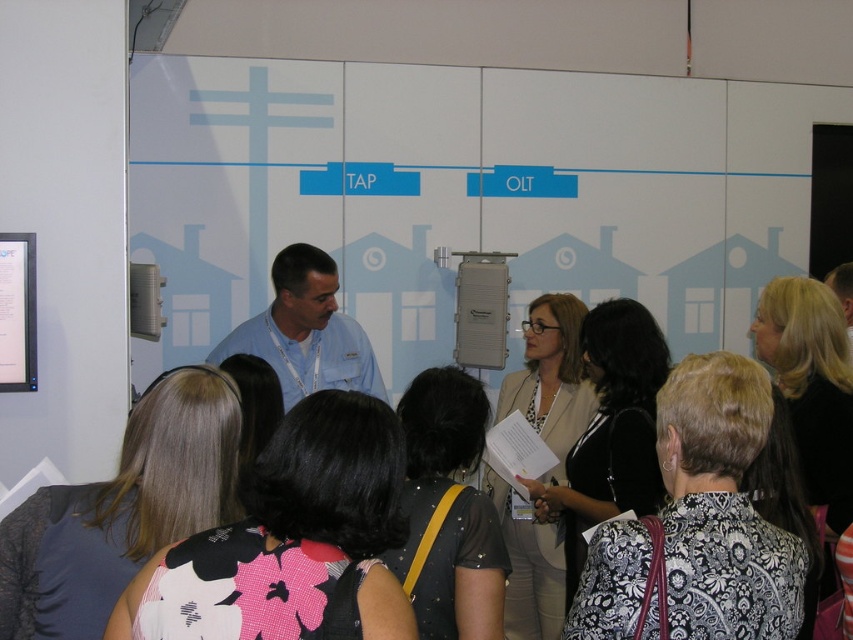
Question: Which point is farther to the camera?

Choices:
 (A) blue shirt at center
 (B) black floral dress at center

Answer: (A)

Question: Does black floral dress at center lie behind blue shirt at center?

Choices:
 (A) yes
 (B) no

Answer: (B)

Question: Among these objects, which one is farthest from the camera?

Choices:
 (A) blue shirt at center
 (B) black floral dress at center

Answer: (A)

Question: From the image, what is the correct spatial relationship of black floral dress at center in relation to blue shirt at center?

Choices:
 (A) below
 (B) above

Answer: (A)

Question: Which of the following is the closest to the observer?

Choices:
 (A) (563, 310)
 (B) (372, 365)

Answer: (A)

Question: Does black floral dress at center have a greater width compared to blue shirt at center?

Choices:
 (A) no
 (B) yes

Answer: (A)